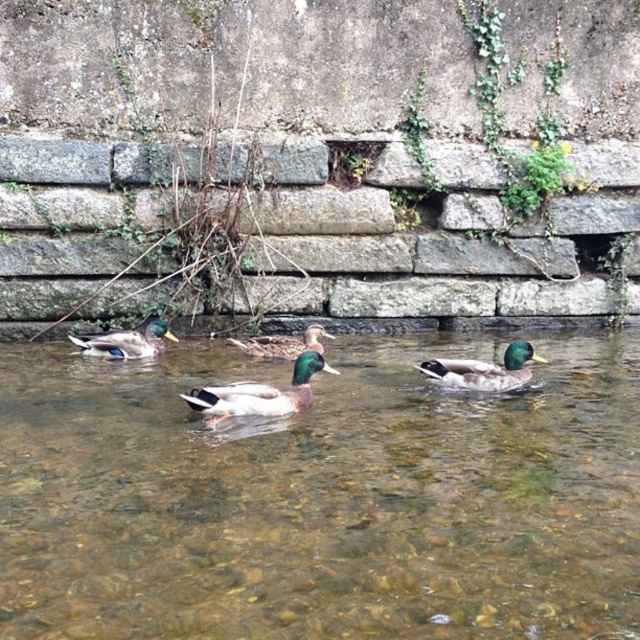
Consider the image. You are a small toy boat that is 10 centimeters long. You want to sail from the clear water at center to the green glossy duck at right. Is there enough space for you to navigate between them?

The clear water at center might be wider than green glossy duck at right, so there is likely enough space for the boat to navigate between them.

You are standing on the edge of the water and see the green glossy duck at right. Can you estimate its position using coordinates?

The green glossy duck at right is located at coordinates point [484,369].

You are standing at the edge of the water and see the green glossy duck at right and the green glossy duck at left. If you want to throw a small pebble to hit both ducks with one throw, is it possible? The pebble can travel 3 meters.

The green glossy duck at right is 2.97 meters from the green glossy duck at left. Since the distance between them is less than 3 meters, it is possible to hit both with one throw if the pebble travels 3 meters.